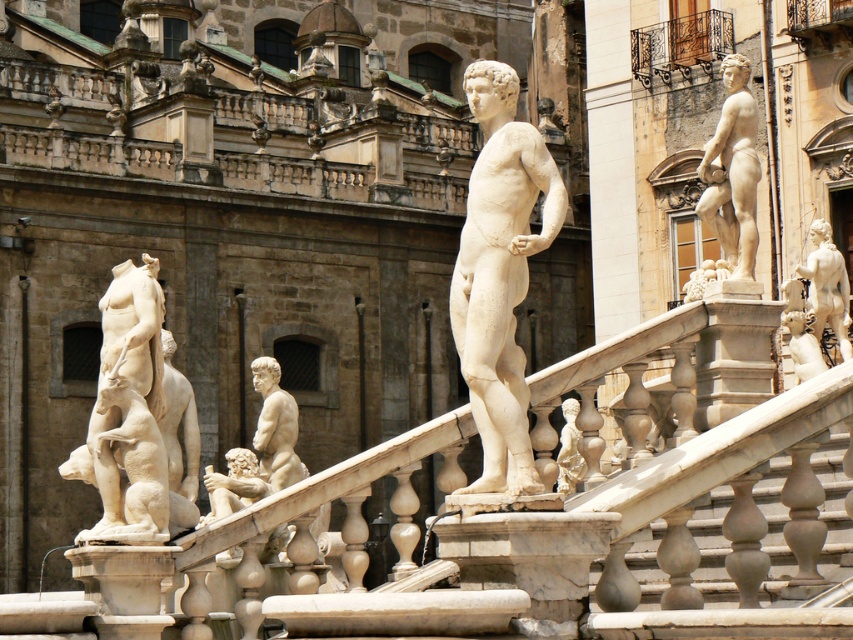
You are a tourist standing in front of the grand marble fountain. You notice the white marble statue at center and the white marble statue at right. Which statue is positioned higher up in the structure?

The white marble statue at center is located above the white marble statue at right, so it is positioned higher up in the structure.

You are standing at the base of the grand marble fountain in the historical square. You want to take a photo of the white marble statue at center with your camera. The camera has a maximum zoom range of 50 feet. Can you capture the entire statue in the photo without moving closer?

The white marble statue at center and camera are 74.36 feet apart from each other. Since the camera can only zoom up to 50 feet, you cannot capture the entire statue in the photo without moving closer.

You are standing in front of the grand marble fountain and want to take a photo. You notice two points marked on the fountain structure. Which point, point (497, 285) or point (102, 314), is closer to your camera lens when focusing on the fountain?

Point (497, 285) is closer to the camera than point (102, 314), so it will be in focus first.